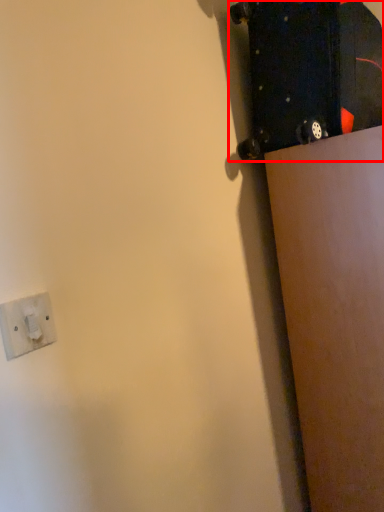
Question: From the image's perspective, what is the correct spatial relationship of skateboard (annotated by the red box) in relation to socket?

Choices:
 (A) above
 (B) below

Answer: (A)